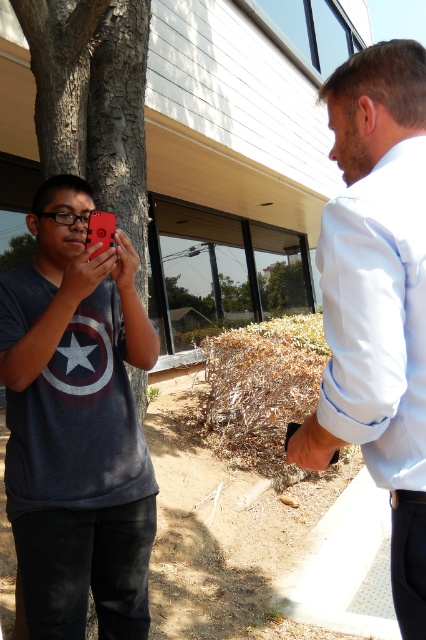
Which of these two, matte black phone at left or white shirt at upper right, stands taller?

With more height is matte black phone at left.

Image resolution: width=426 pixels, height=640 pixels. What are the coordinates of `matte black phone at left` in the screenshot? It's located at (77, 422).

In order to click on matte black phone at left in this screenshot , I will do `click(77, 422)`.

Is point (69, 602) farther from camera compared to point (28, 257)?

No, (69, 602) is closer to viewer.

Does matte black phone at left have a lesser height compared to green leafy tree at left?

In fact, matte black phone at left may be taller than green leafy tree at left.

Is point (74, 484) positioned in front of point (11, 243)?

Yes.

Identify the location of matte black phone at left. (77, 422).

Find the location of a particular element. This screenshot has height=640, width=426. smooth bark tree at left is located at coordinates (92, 99).

Can you confirm if smooth bark tree at left is taller than green leafy tree at left?

Indeed, smooth bark tree at left has a greater height compared to green leafy tree at left.

Does point (80, 97) come farther from viewer compared to point (5, 268)?

No.

Find the location of a particular element. The image size is (426, 640). smooth bark tree at left is located at coordinates (92, 99).